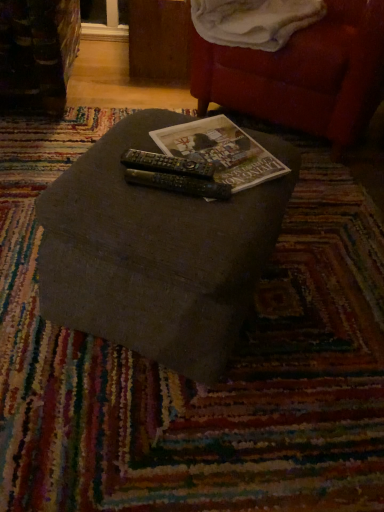
Identify the location of free space in front of black plastic remote at center, acting as the second remote starting from the back. This screenshot has height=512, width=384. (177, 218).